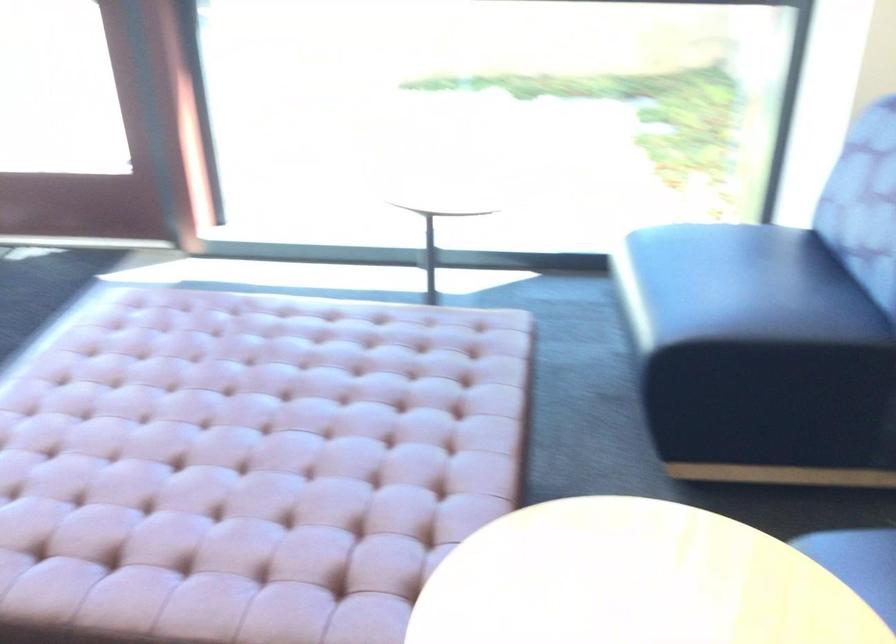
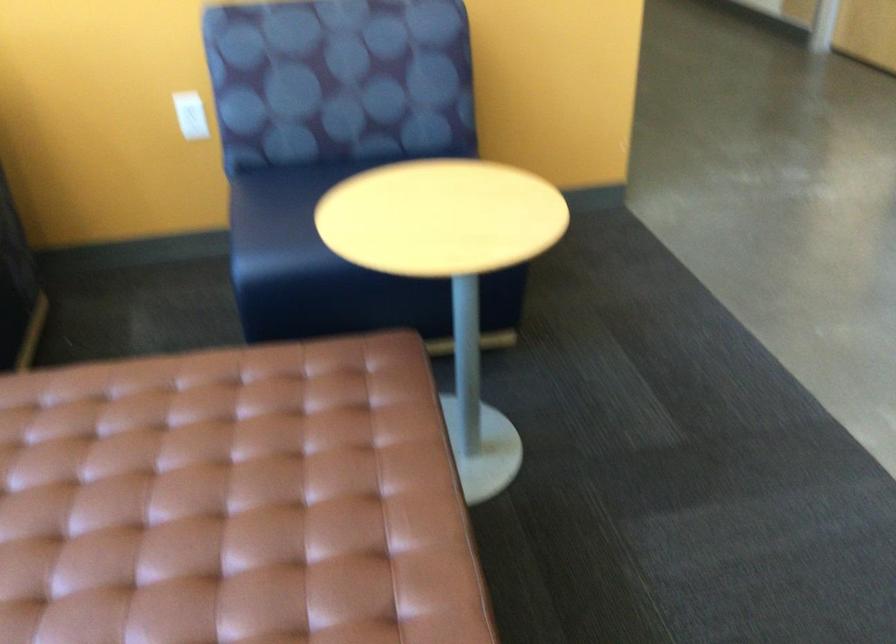
Find the pixel in the second image that matches point (229, 478) in the first image.

(231, 502)